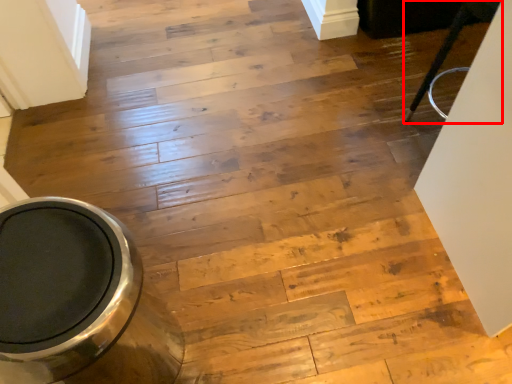
Question: From the image's perspective, where is furniture (annotated by the red box) located relative to toilet bowl?

Choices:
 (A) above
 (B) below

Answer: (A)